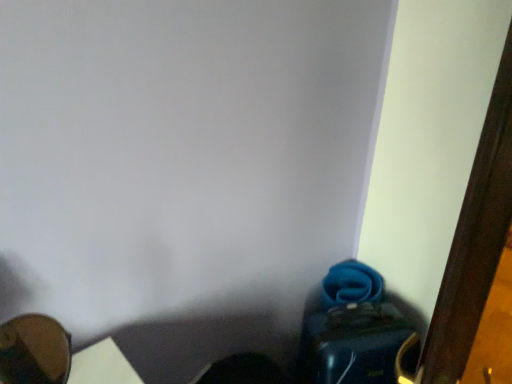
Measure the distance between brown leather shoe at lower left and camera.

brown leather shoe at lower left is 27.48 inches away from camera.

What do you see at coordinates (34, 351) in the screenshot? I see `brown leather shoe at lower left` at bounding box center [34, 351].

In order to click on brown leather shoe at lower left in this screenshot , I will do `click(34, 351)`.

In order to click on brown leather shoe at lower left in this screenshot , I will do `click(34, 351)`.